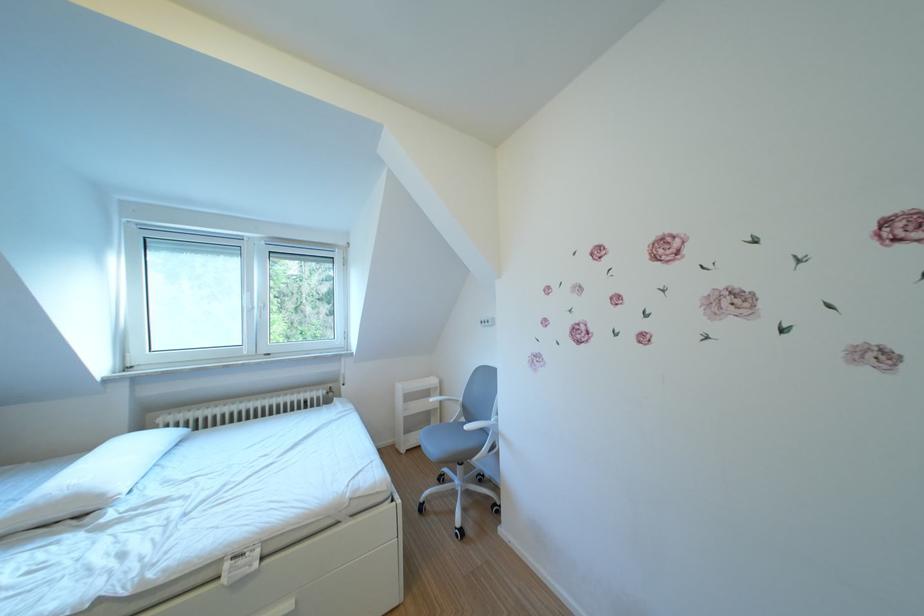
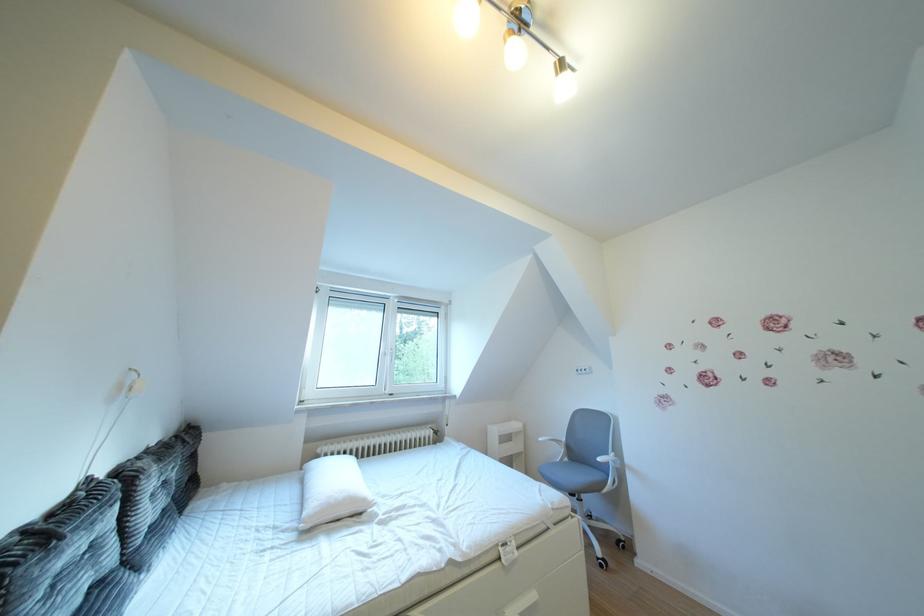
What movement of the cameraman would produce the second image?

The cameraman moved toward left, backward.